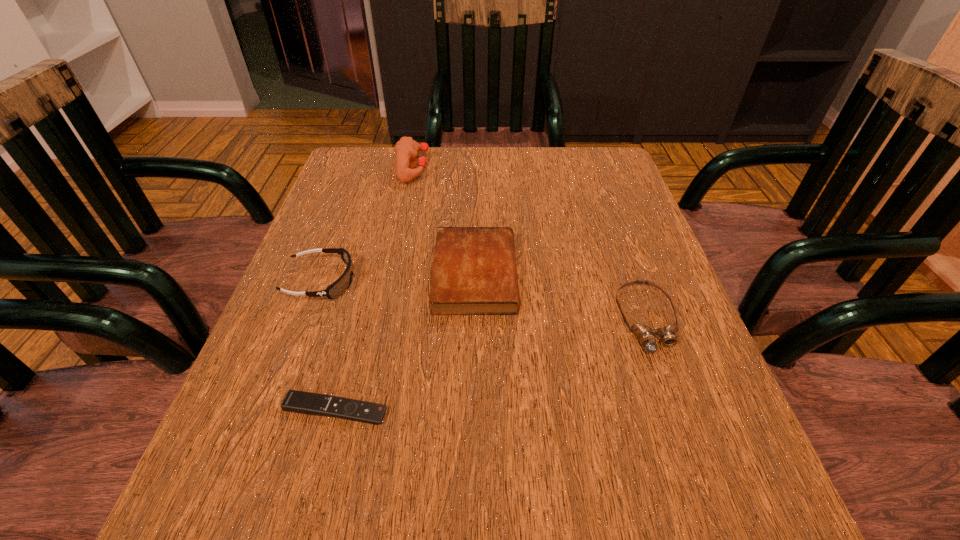
At what (x,y) coordinates should I click in order to perform the action: click on object present at the far left corner. Please return your answer as a coordinate pair (x, y). Looking at the image, I should click on (406, 149).

At what (x,y) coordinates should I click in order to perform the action: click on free region at the far edge of the desktop. Please return your answer as a coordinate pair (x, y). Image resolution: width=960 pixels, height=540 pixels. Looking at the image, I should click on (503, 196).

Where is `vacant position at the left edge of the desktop`? vacant position at the left edge of the desktop is located at coordinates (324, 313).

I want to click on free location at the right edge of the desktop, so click(635, 342).

This screenshot has width=960, height=540. Find the location of `free region at the far left corner of the desktop`. free region at the far left corner of the desktop is located at coordinates (386, 150).

You are a GUI agent. You are given a task and a screenshot of the screen. Output one action in this format:
    pyautogui.click(x=<x>, y=<y>)
    Task: Click on the vacant region at the far right corner of the desktop
    This screenshot has height=540, width=960.
    Given the screenshot: What is the action you would take?
    pyautogui.click(x=604, y=191)

Locate an element on the screen. free space at the near right corner of the desktop is located at coordinates (686, 504).

Where is `vacant space that is in between the remote control and the shorter goggles`? This screenshot has height=540, width=960. vacant space that is in between the remote control and the shorter goggles is located at coordinates (492, 364).

Find the location of `vacant space in between the taller goggles and the nearest object`. vacant space in between the taller goggles and the nearest object is located at coordinates (328, 346).

This screenshot has width=960, height=540. I want to click on vacant area between the fourth shortest object and the shortest object, so click(328, 346).